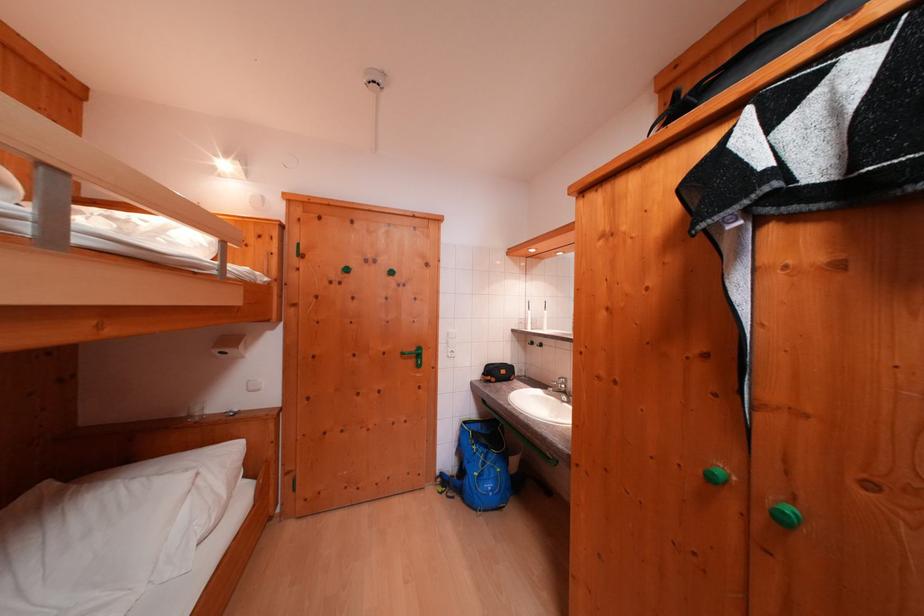
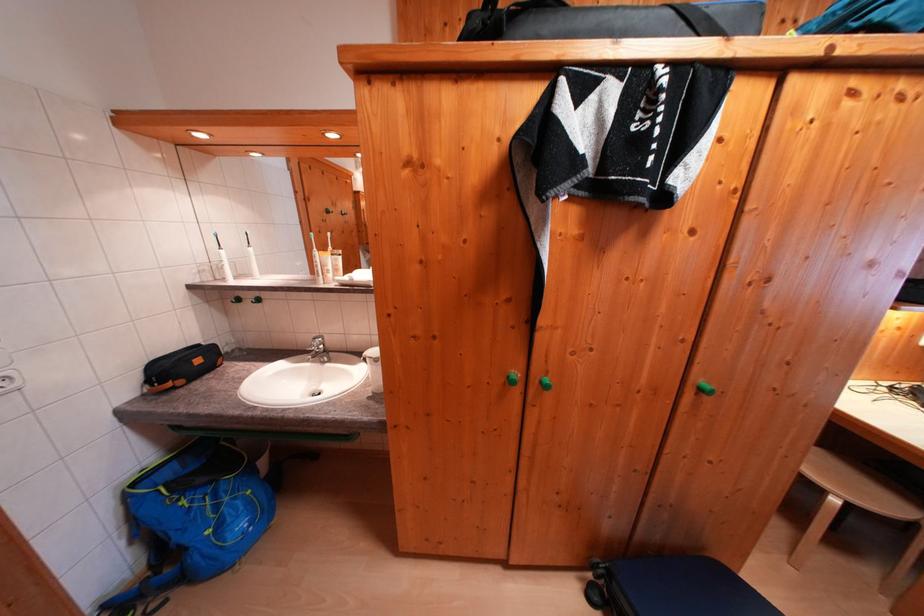
Find the pixel in the second image that matches [473,427] in the first image.

(142, 488)